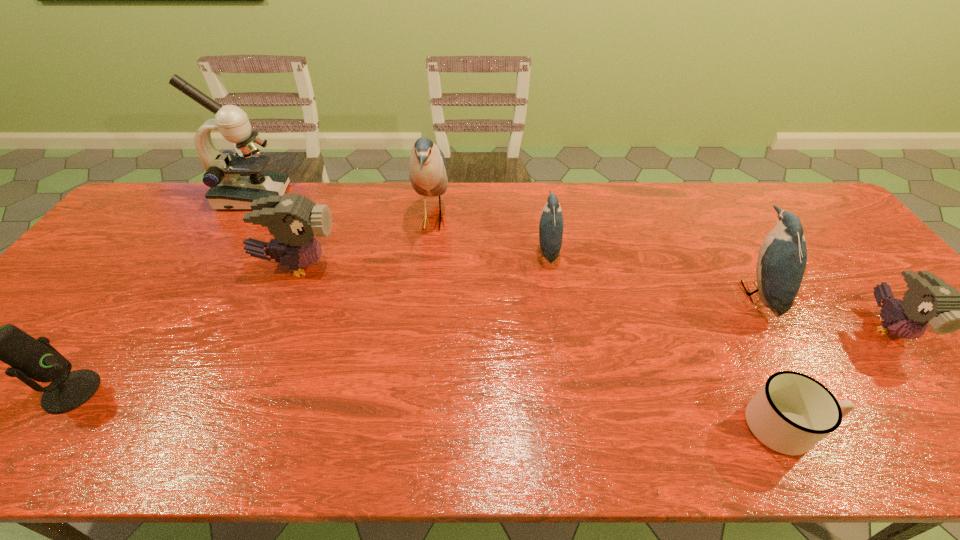
At what (x,y) coordinates should I click in order to perform the action: click on the rightmost bird. Please return your answer as a coordinate pair (x, y). This screenshot has width=960, height=540. Looking at the image, I should click on (929, 299).

Identify the location of the right gray bird. The width and height of the screenshot is (960, 540). (929, 299).

This screenshot has height=540, width=960. Identify the location of mug. (792, 412).

Where is `vacant position located 0.370m at the eyepiece of the tallest object`? vacant position located 0.370m at the eyepiece of the tallest object is located at coordinates (395, 197).

You are a GUI agent. You are given a task and a screenshot of the screen. Output one action in this format:
    pyautogui.click(x=<x>, y=<y>)
    Task: Click on the blank area located at the tip of the second bird from left to right's beak
    The width and height of the screenshot is (960, 540).
    Given the screenshot: What is the action you would take?
    pyautogui.click(x=535, y=220)

You are a GUI agent. You are given a task and a screenshot of the screen. Output one action in this format:
    pyautogui.click(x=<x>, y=<y>)
    Task: Click on the blank space located at the tip of the second smallest blue bird's beak
    
    Given the screenshot: What is the action you would take?
    pyautogui.click(x=671, y=293)

Identify the location of blank area located at the tip of the second smallest blue bird's beak. (694, 293).

Find the location of a particular element. The width and height of the screenshot is (960, 540). vacant space situated at the tip of the second smallest blue bird's beak is located at coordinates pos(637,293).

Identify the location of free space located at the beak of the sixth object from right to left. This screenshot has width=960, height=540. (404, 266).

Locate an element on the screen. The width and height of the screenshot is (960, 540). vacant space located on the right of the microphone is located at coordinates (214, 392).